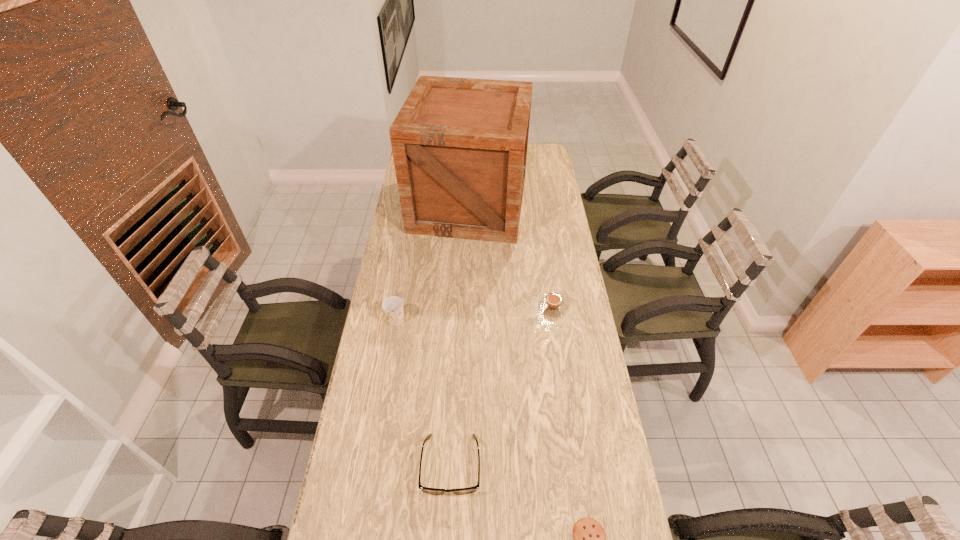
Where is `box present at the right edge`? box present at the right edge is located at coordinates (459, 145).

You are a GUI agent. You are given a task and a screenshot of the screen. Output one action in this format:
    pyautogui.click(x=<x>, y=<y>)
    Task: Click on the cappuccino located in the right edge section of the desktop
    The image size is (960, 540).
    Given the screenshot: What is the action you would take?
    pyautogui.click(x=553, y=304)

This screenshot has height=540, width=960. Find the location of `blank space at the left edge`. blank space at the left edge is located at coordinates (420, 247).

This screenshot has height=540, width=960. In the image, there is a desktop. What are the coordinates of `vacant space at the right edge` in the screenshot? It's located at (623, 508).

Locate an element on the screen. free space at the far right corner is located at coordinates (535, 159).

Image resolution: width=960 pixels, height=540 pixels. I want to click on vacant region between the second nearest object and the farthest object, so click(460, 335).

Locate an element on the screen. free area in between the box and the cappuccino is located at coordinates (511, 256).

You are a GUI agent. You are given a task and a screenshot of the screen. Output one action in this format:
    pyautogui.click(x=<x>, y=<y>)
    Task: Click on the vacant area that lies between the cappuccino and the spectacles
    
    Given the screenshot: What is the action you would take?
    pyautogui.click(x=502, y=386)

At what (x,y) coordinates should I click in order to perform the action: click on free spot between the second nearest object and the Dixie cup. Please return your answer as a coordinate pair (x, y). Looking at the image, I should click on click(423, 393).

Find the location of a particular element. free space between the cappuccino and the fourth farthest object is located at coordinates point(502,386).